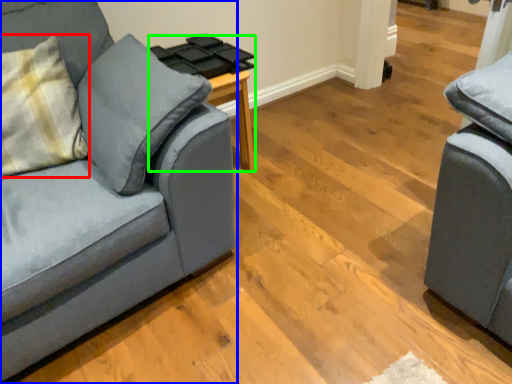
Question: Which object is positioned farthest from throw pillow (highlighted by a red box)? Select from studio couch (highlighted by a blue box) and side table (highlighted by a green box).

Choices:
 (A) studio couch
 (B) side table

Answer: (B)